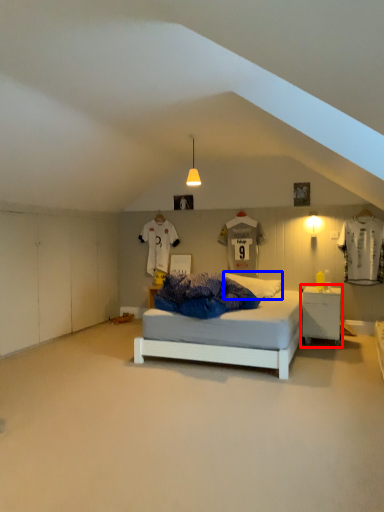
Question: Which point is further to the camera, nightstand (highlighted by a red box) or pillow (highlighted by a blue box)?

Choices:
 (A) nightstand
 (B) pillow

Answer: (B)